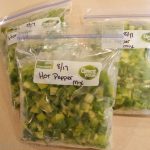
Where is `table`? The image size is (150, 150). table is located at coordinates (126, 140).